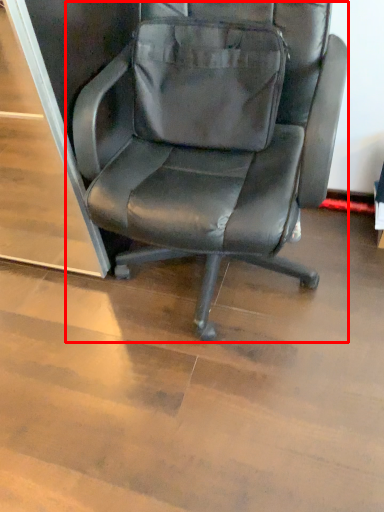
Question: Considering the relative positions of chair (annotated by the red box) and messenger bag in the image provided, where is chair (annotated by the red box) located with respect to the staircase?

Choices:
 (A) left
 (B) right

Answer: (B)